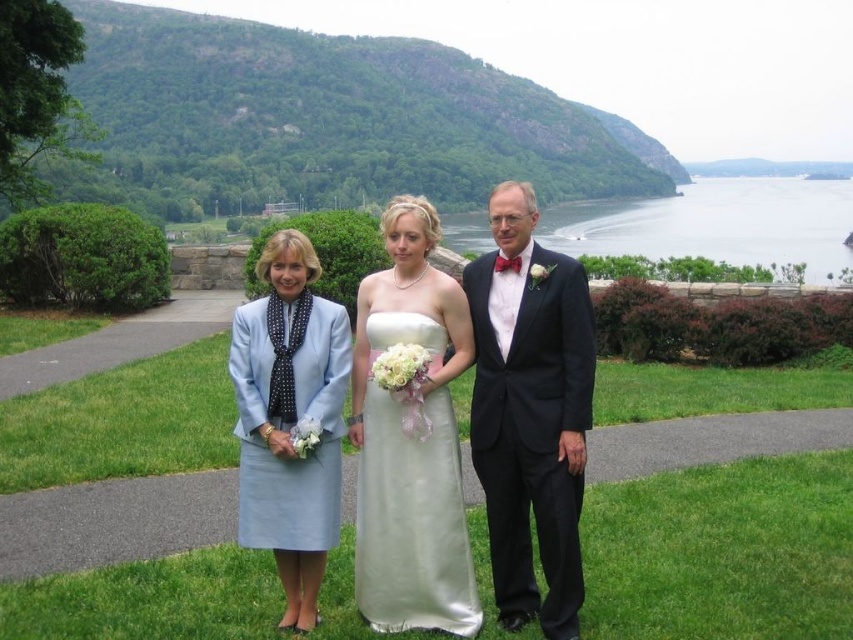
Which is behind, point (318, 390) or point (368, 589)?

The point (318, 390) is more distant.

Who is more forward, (x=239, y=515) or (x=386, y=557)?

Point (x=386, y=557) is in front.

You are a GUI agent. You are given a task and a screenshot of the screen. Output one action in this format:
    pyautogui.click(x=<x>, y=<y>)
    Task: Click on the light blue fabric dress at center
    
    Given the screenshot: What is the action you would take?
    pyautogui.click(x=289, y=419)

Is black satin suit at center bigger than clear blue water at upper center?

Incorrect, black satin suit at center is not larger than clear blue water at upper center.

Where is `black satin suit at center`? The width and height of the screenshot is (853, 640). black satin suit at center is located at coordinates (531, 412).

The width and height of the screenshot is (853, 640). What do you see at coordinates (485, 406) in the screenshot?
I see `white satin dress at center` at bounding box center [485, 406].

Is white satin dress at center thinner than light blue fabric dress at center?

No.

Describe the element at coordinates (485, 406) in the screenshot. The height and width of the screenshot is (640, 853). I see `white satin dress at center` at that location.

At what (x,y) coordinates should I click in order to perform the action: click on white satin dress at center. Please return your answer as a coordinate pair (x, y). Image resolution: width=853 pixels, height=640 pixels. Looking at the image, I should click on (485, 406).